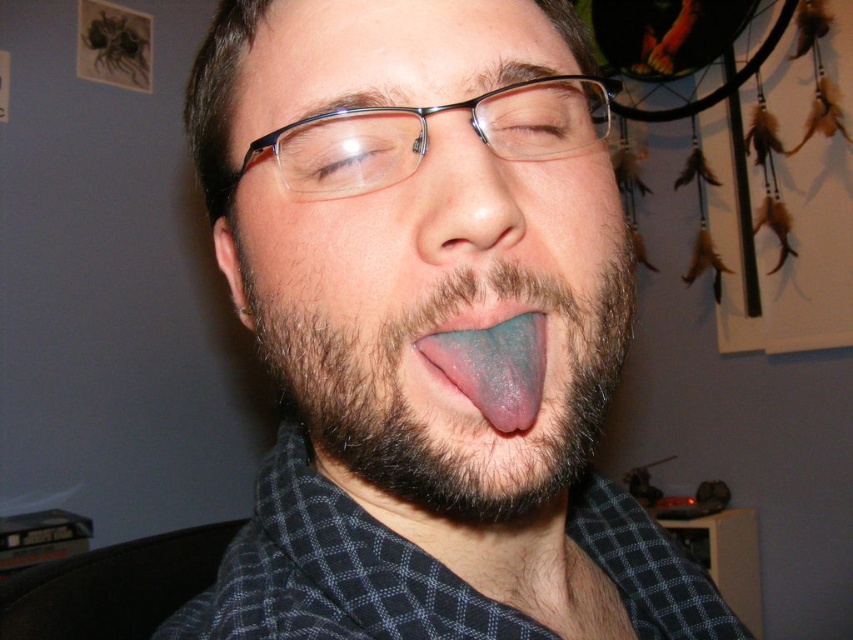
You are a dentist examining a patient and notice two tongues in the image, a matte blue tongue at center and a blue glossy tongue at center. Which one is located to the left of the other?

The matte blue tongue at center is positioned on the left side of the blue glossy tongue at center.